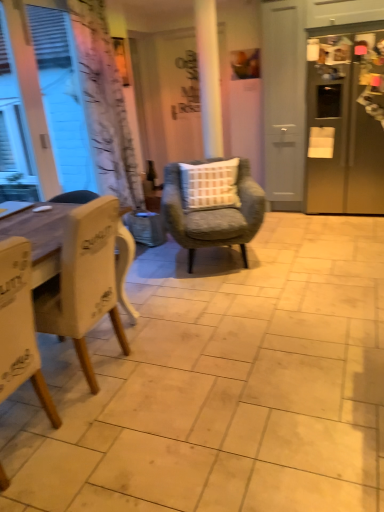
Locate an element on the screen. This screenshot has height=512, width=384. textured gray armchair at center, the third chair positioned from the front is located at coordinates (213, 215).

What is the approximate height of white wood chair at left, which is counted as the third chair, starting from the back?

It is 38.24 inches.

Describe the element at coordinates (83, 281) in the screenshot. I see `white wood chair at left, the second chair when ordered from front to back` at that location.

Identify the location of textured gray armchair at center, the third chair positioned from the front. (213, 215).

Between satin silver refrigerator at right and white wood chair at left, the second chair when ordered from front to back, which one is positioned in front?

white wood chair at left, the second chair when ordered from front to back, is more forward.

Is satin silver refrigerator at right shorter than white wood chair at left, which appears as the second chair when viewed from the back?

No, satin silver refrigerator at right is not shorter than white wood chair at left, which appears as the second chair when viewed from the back.

Does point (372, 190) come farther from viewer compared to point (100, 204)?

That is True.

From a real-world perspective, is satin silver refrigerator at right above or below white wood chair at left, which appears as the second chair when viewed from the back?

Clearly, from a real-world perspective, satin silver refrigerator at right is above white wood chair at left, which appears as the second chair when viewed from the back.

In terms of width, does white matte window screen at left look wider or thinner when compared to textured gray armchair at center, which appears as the first chair when viewed from the back?

In the image, white matte window screen at left appears to be more narrow than textured gray armchair at center, which appears as the first chair when viewed from the back.

Looking at this image, is white matte window screen at left positioned with its back to textured gray armchair at center, the third chair positioned from the front?

No.

Considering the sizes of objects white matte window screen at left and textured gray armchair at center, which appears as the first chair when viewed from the back, in the image provided, who is bigger, white matte window screen at left or textured gray armchair at center, which appears as the first chair when viewed from the back,?

With larger size is textured gray armchair at center, which appears as the first chair when viewed from the back.

Which object is positioned more to the right, white matte window screen at left or textured gray armchair at center, the third chair positioned from the front?

Positioned to the right is textured gray armchair at center, the third chair positioned from the front.

Considering the relative sizes of white matte window screen at left and clear glass bottle at center in the image provided, is white matte window screen at left shorter than clear glass bottle at center?

No, white matte window screen at left is not shorter than clear glass bottle at center.

Considering the sizes of objects white matte window screen at left and clear glass bottle at center in the image provided, who is smaller, white matte window screen at left or clear glass bottle at center?

clear glass bottle at center.

From the image's perspective, relative to clear glass bottle at center, is white matte window screen at left above or below?

Clearly, from the image's perspective, white matte window screen at left is above clear glass bottle at center.

Can you tell me how much clear glass bottle at center and satin silver refrigerator at right differ in facing direction?

The facing directions of clear glass bottle at center and satin silver refrigerator at right are 90 degrees apart.

Could satin silver refrigerator at right be considered to be inside clear glass bottle at center?

No, satin silver refrigerator at right is not inside clear glass bottle at center.

Does clear glass bottle at center have a larger size compared to satin silver refrigerator at right?

No.

Between clear glass bottle at center and satin silver refrigerator at right, which one has larger width?

satin silver refrigerator at right is wider.

Is white matte window at left turned away from satin silver refrigerator at right?

No, white matte window at left's orientation is not away from satin silver refrigerator at right.

At what (x,y) coordinates should I click in order to perform the action: click on window on the left side of satin silver refrigerator at right. Please return your answer as a coordinate pair (x, y). The height and width of the screenshot is (512, 384). Looking at the image, I should click on (14, 131).

Can you confirm if white matte window at left is smaller than satin silver refrigerator at right?

Yes.

In the scene shown: Is white matte window at left touching satin silver refrigerator at right?

white matte window at left and satin silver refrigerator at right are not in contact.

Does point (0, 169) lie behind point (147, 161)?

No, it is not.

Based on the photo, between white matte window at left and clear glass bottle at center, which one has less height?

clear glass bottle at center.

Is white matte window at left facing towards clear glass bottle at center?

No.

Who is smaller, white matte window at left or clear glass bottle at center?

clear glass bottle at center is smaller.

Considering the positions of points (31, 322) and (60, 30), is point (31, 322) closer to camera compared to point (60, 30)?

That is True.

Is white wood chair at left, the first chair from the front, in front of white matte window screen at left?

Yes, it is in front of white matte window screen at left.

Is white wood chair at left, the first chair from the front, beside white matte window screen at left?

No, white wood chair at left, the first chair from the front, is not beside white matte window screen at left.

Starting from the satin silver refrigerator at right, which chair is the 2nd one to the left? Please provide its 2D coordinates.

[(83, 281)]

This screenshot has height=512, width=384. I want to click on chair that is the 3rd one below the white matte window screen at left (from a real-world perspective), so click(213, 215).

Looking at the image, which one is located closer to white matte window at left, textured gray armchair at center, the third chair positioned from the front, or satin silver refrigerator at right?

textured gray armchair at center, the third chair positioned from the front, is positioned closer to the anchor white matte window at left.

From the image, which object appears to be nearer to white matte window screen at left, white wood chair at left, which appears as the second chair when viewed from the back, or textured gray armchair at center, which appears as the first chair when viewed from the back?

textured gray armchair at center, which appears as the first chair when viewed from the back, is closer to white matte window screen at left.

Based on their spatial positions, is white matte window screen at left or clear glass bottle at center further from white wood chair at left, which is counted as the third chair, starting from the back?

Among the two, clear glass bottle at center is located further to white wood chair at left, which is counted as the third chair, starting from the back.

Considering their positions, is white matte window at left positioned further to satin silver refrigerator at right than textured gray armchair at center, the third chair positioned from the front?

white matte window at left.

When comparing their distances from satin silver refrigerator at right, does white wood chair at left, which is counted as the third chair, starting from the back, or clear glass bottle at center seem further?

white wood chair at left, which is counted as the third chair, starting from the back, lies further to satin silver refrigerator at right than the other object.

Estimate the real-world distances between objects in this image. Which object is further from textured gray armchair at center, the third chair positioned from the front, white matte window at left or white wood chair at left, which is counted as the third chair, starting from the back?

white wood chair at left, which is counted as the third chair, starting from the back, lies further to textured gray armchair at center, the third chair positioned from the front, than the other object.

Which object lies nearer to the anchor point clear glass bottle at center, white matte window at left or satin silver refrigerator at right?

Among the two, white matte window at left is located nearer to clear glass bottle at center.

Considering their positions, is white wood chair at left, which is counted as the third chair, starting from the back, positioned further to white wood chair at left, which appears as the second chair when viewed from the back, than white matte window screen at left?

white matte window screen at left is positioned further to the anchor white wood chair at left, which appears as the second chair when viewed from the back.

Identify the location of window screen located between white wood chair at left, which appears as the second chair when viewed from the back, and textured gray armchair at center, which appears as the first chair when viewed from the back, in the depth direction. This screenshot has width=384, height=512. (41, 106).

Image resolution: width=384 pixels, height=512 pixels. What are the coordinates of `window positioned between white wood chair at left, the first chair from the front, and white matte window screen at left from near to far` in the screenshot? It's located at tap(14, 131).

The width and height of the screenshot is (384, 512). What are the coordinates of `chair between white wood chair at left, which is counted as the third chair, starting from the back, and textured gray armchair at center, the third chair positioned from the front, in the front-back direction` in the screenshot? It's located at (83, 281).

Locate an element on the screen. This screenshot has width=384, height=512. window located between white wood chair at left, the first chair from the front, and textured gray armchair at center, the third chair positioned from the front, in the depth direction is located at coordinates (14, 131).